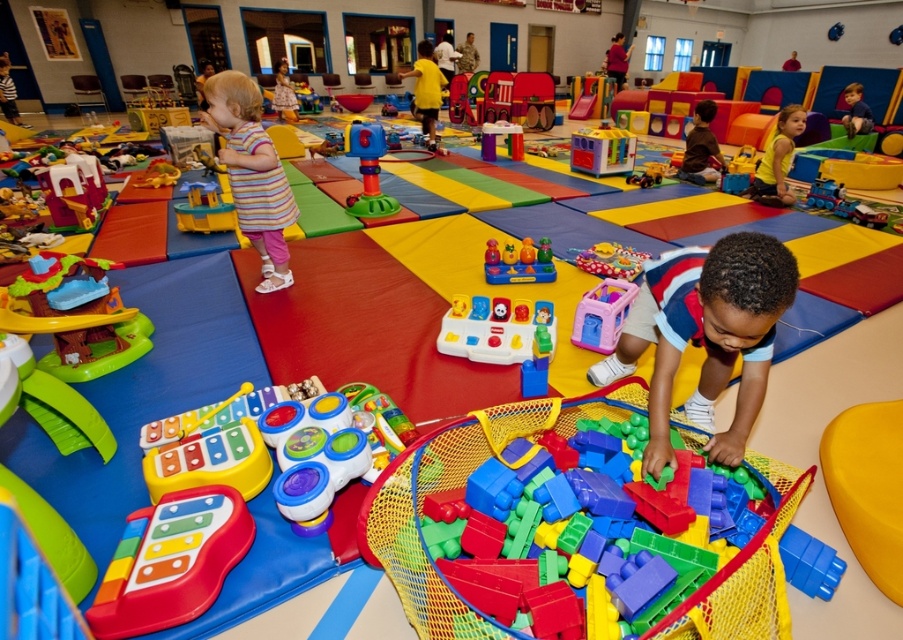
You are a parent looking to buy a toy for your child. You see the smooth plastic castle at left and the matte blue plastic toy at center. Which toy is shorter?

The smooth plastic castle at left is shorter than the matte blue plastic toy at center.

You are a parent trying to store the translucent plastic toy at center and the rubberized plastic toy car at center in a small container. Which toy will you place first to ensure both fit?

The translucent plastic toy at center is smaller than the rubberized plastic toy car at center, so you should place the rubberized plastic toy car at center first to make space for the smaller one.

From the picture: You are a parent trying to retrieve your child from the play area. You see the translucent plastic toy at center and the rubberized plastic toy car at center. Which toy is closer to you?

The translucent plastic toy at center is closer to the viewer than the rubberized plastic toy car at center.